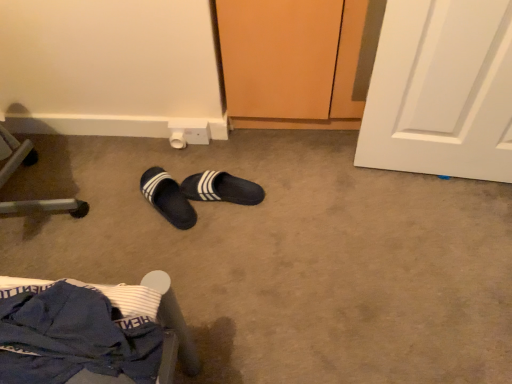
Question: Considering the relative sizes of black fabric slippers at center, the 1th footwear viewed from the right, and blue fabric chair at lower left in the image provided, is black fabric slippers at center, the 1th footwear viewed from the right, taller than blue fabric chair at lower left?

Choices:
 (A) yes
 (B) no

Answer: (B)

Question: Can you see black fabric slippers at center, the 1th footwear viewed from the right, touching blue fabric chair at lower left?

Choices:
 (A) no
 (B) yes

Answer: (A)

Question: Can you confirm if black fabric slippers at center, the 1th footwear viewed from the right, is positioned to the right of blue fabric chair at lower left?

Choices:
 (A) yes
 (B) no

Answer: (A)

Question: Does black fabric slippers at center, the 1th footwear viewed from the right, come behind blue fabric chair at lower left?

Choices:
 (A) no
 (B) yes

Answer: (B)

Question: From a real-world perspective, is black fabric slippers at center, the 1th footwear viewed from the right, positioned over blue fabric chair at lower left based on gravity?

Choices:
 (A) no
 (B) yes

Answer: (A)

Question: In terms of height, does black fuzzy slippers at center, the 2th footwear when ordered from right to left, look taller or shorter compared to blue fabric chair at lower left?

Choices:
 (A) tall
 (B) short

Answer: (B)

Question: From a real-world perspective, is black fuzzy slippers at center, which is counted as the first footwear, starting from the left, positioned above or below blue fabric chair at lower left?

Choices:
 (A) below
 (B) above

Answer: (A)

Question: From the image's perspective, is black fuzzy slippers at center, which is counted as the first footwear, starting from the left, above or below blue fabric chair at lower left?

Choices:
 (A) below
 (B) above

Answer: (B)

Question: Is black fuzzy slippers at center, which is counted as the first footwear, starting from the left, spatially inside blue fabric chair at lower left, or outside of it?

Choices:
 (A) outside
 (B) inside

Answer: (A)

Question: From a real-world perspective, is black fabric slippers at center, the 2th footwear in the left-to-right sequence, positioned above or below blue fabric chair at lower left?

Choices:
 (A) above
 (B) below

Answer: (B)

Question: Is point (200, 178) positioned closer to the camera than point (182, 355)?

Choices:
 (A) closer
 (B) farther

Answer: (B)

Question: Is black fabric slippers at center, the 1th footwear viewed from the right, inside or outside of blue fabric chair at lower left?

Choices:
 (A) inside
 (B) outside

Answer: (B)

Question: Considering their positions, is black fabric slippers at center, the 1th footwear viewed from the right, located in front of or behind blue fabric chair at lower left?

Choices:
 (A) behind
 (B) front

Answer: (A)

Question: Is black fabric slippers at center, the 2th footwear in the left-to-right sequence, taller or shorter than black fuzzy slippers at center, the 2th footwear when ordered from right to left?

Choices:
 (A) short
 (B) tall

Answer: (A)

Question: Considering the positions of point (237, 183) and point (166, 205), is point (237, 183) closer or farther from the camera than point (166, 205)?

Choices:
 (A) farther
 (B) closer

Answer: (A)